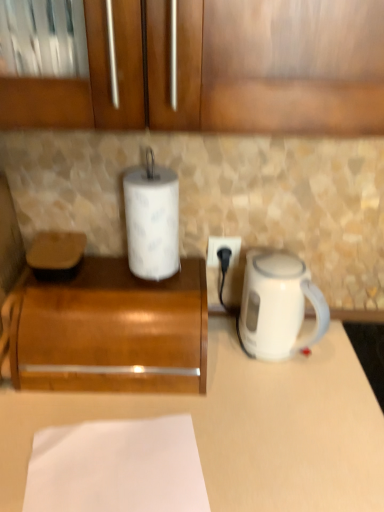
In order to click on empty space that is in between white glossy electric kettle at right and white paper at lower center in this screenshot , I will do `click(220, 404)`.